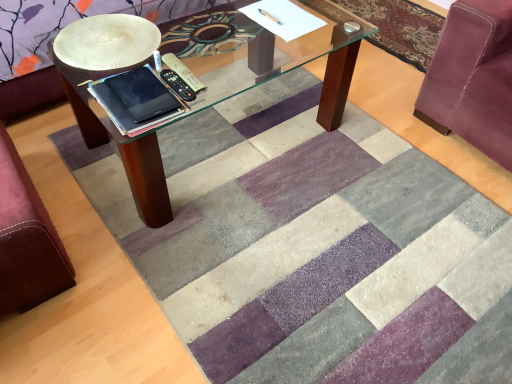
Locate an element on the screen. Image resolution: width=512 pixels, height=384 pixels. vacant location below black matte tablet at center (from a real-world perspective) is located at coordinates (139, 91).